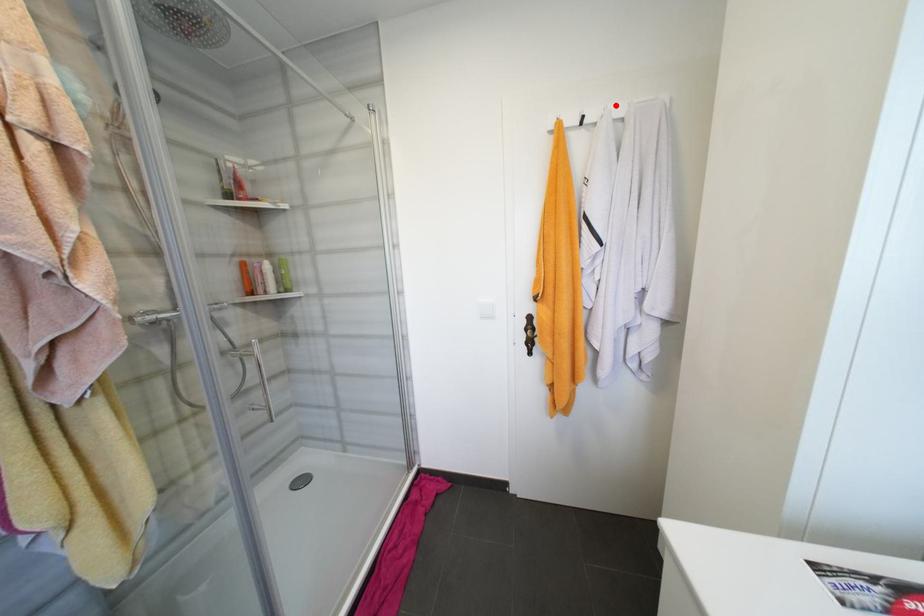
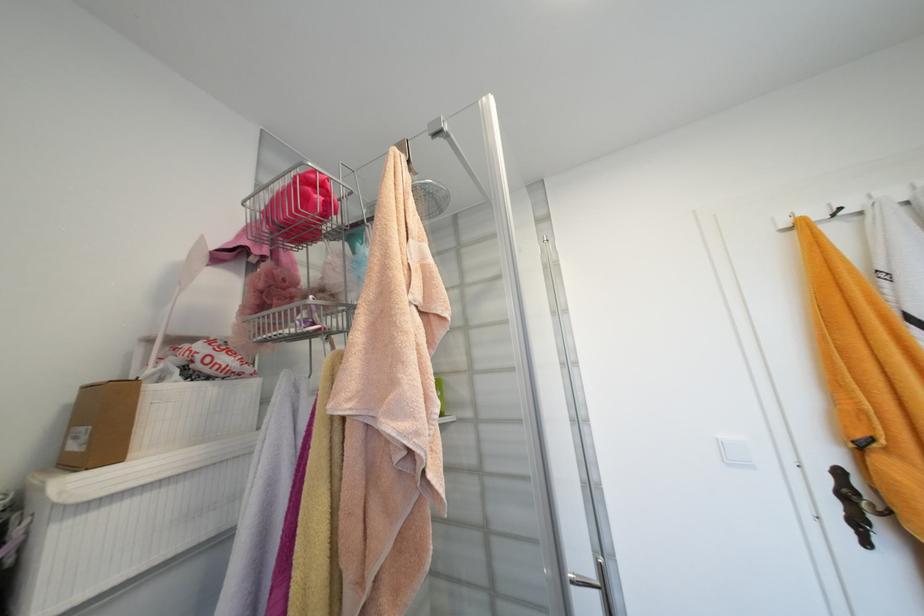
The point at the highlighted location is marked in the first image. Where is the corresponding point in the second image?

(885, 193)